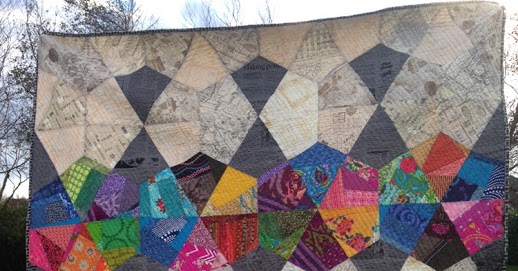
Locate an element on the screen. This screenshot has width=518, height=271. quilt is located at coordinates (193, 220).